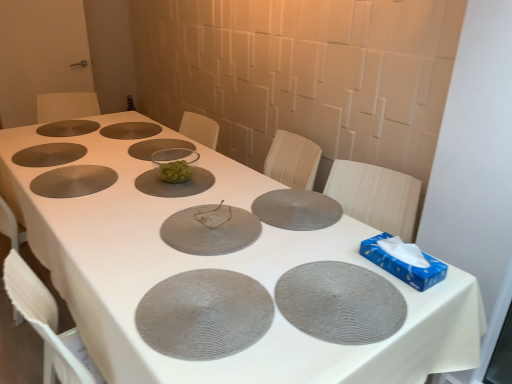
Identify the location of vacant area that is in front of matte gray glass plate at center, which ranks as the eighth glass plate in back-to-front order. (178, 263).